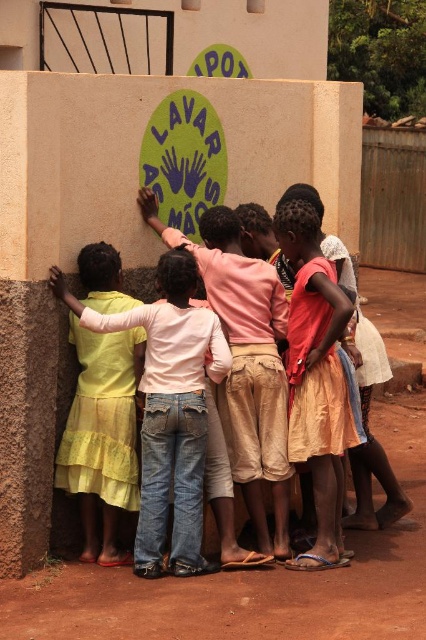
Question: Which of these objects is positioned closest to the light yellow denim jeans at left?

Choices:
 (A) light orange skirt at center
 (B) pink cotton shirt at center

Answer: (B)

Question: Is light yellow denim jeans at left positioned at the back of light orange skirt at center?

Choices:
 (A) no
 (B) yes

Answer: (A)

Question: Which point is farther to the camera?

Choices:
 (A) light orange skirt at center
 (B) light yellow denim jeans at left

Answer: (A)

Question: Which point is closer to the camera taking this photo?

Choices:
 (A) (317, 362)
 (B) (149, 532)
 (C) (219, 262)

Answer: (B)

Question: Does pink cotton shirt at center have a lesser width compared to light orange skirt at center?

Choices:
 (A) no
 (B) yes

Answer: (A)

Question: Is light yellow denim jeans at left to the right of light orange skirt at center from the viewer's perspective?

Choices:
 (A) yes
 (B) no

Answer: (B)